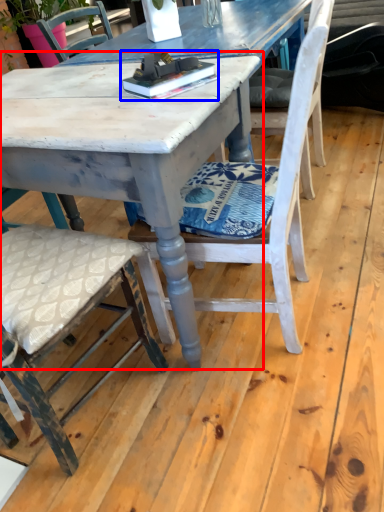
Question: Which of the following is the farthest to the observer, round table (highlighted by a red box) or book (highlighted by a blue box)?

Choices:
 (A) round table
 (B) book

Answer: (B)